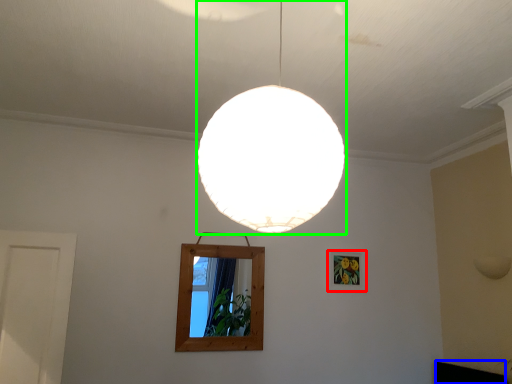
Question: Which is farther away from picture frame (highlighted by a red box)? furniture (highlighted by a blue box) or lamp (highlighted by a green box)?

Choices:
 (A) furniture
 (B) lamp

Answer: (B)